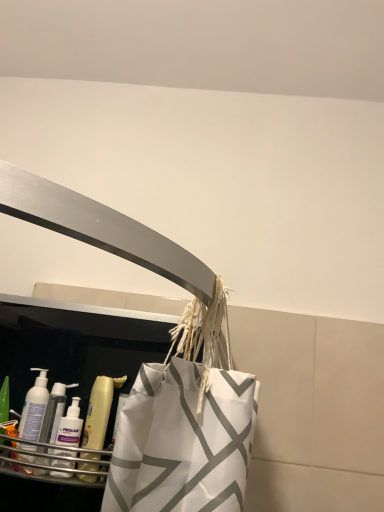
Question: Is translucent plastic bottle at left, marked as the second cleaning product in a left-to-right arrangement, completely or partially inside white plastic bottle at lower left, which is the 1th cleaning product in left-to-right order?

Choices:
 (A) no
 (B) yes

Answer: (A)

Question: Can you confirm if white plastic bottle at lower left, which is the 1th cleaning product in left-to-right order, is smaller than translucent plastic bottle at left, which is counted as the 1th cleaning product, starting from the right?

Choices:
 (A) yes
 (B) no

Answer: (B)

Question: Is white plastic bottle at lower left, which is the 1th cleaning product in left-to-right order, to the left of translucent plastic bottle at left, marked as the second cleaning product in a left-to-right arrangement, from the viewer's perspective?

Choices:
 (A) yes
 (B) no

Answer: (A)

Question: Is the depth of white plastic bottle at lower left, which is the second cleaning product from right to left, greater than that of translucent plastic bottle at left, marked as the second cleaning product in a left-to-right arrangement?

Choices:
 (A) no
 (B) yes

Answer: (B)

Question: From the image's perspective, does white plastic bottle at lower left, which is the 1th cleaning product in left-to-right order, appear lower than translucent plastic bottle at left, marked as the second cleaning product in a left-to-right arrangement?

Choices:
 (A) yes
 (B) no

Answer: (B)

Question: From a real-world perspective, is translucent plastic mouthwash at lower left above or below translucent plastic bottle at left, which is counted as the 1th cleaning product, starting from the right?

Choices:
 (A) below
 (B) above

Answer: (B)

Question: Considering the relative positions of translucent plastic mouthwash at lower left and translucent plastic bottle at left, marked as the second cleaning product in a left-to-right arrangement, in the image provided, is translucent plastic mouthwash at lower left to the left or to the right of translucent plastic bottle at left, marked as the second cleaning product in a left-to-right arrangement,?

Choices:
 (A) left
 (B) right

Answer: (B)

Question: Considering the positions of translucent plastic mouthwash at lower left and translucent plastic bottle at left, marked as the second cleaning product in a left-to-right arrangement, in the image, is translucent plastic mouthwash at lower left bigger or smaller than translucent plastic bottle at left, marked as the second cleaning product in a left-to-right arrangement,?

Choices:
 (A) small
 (B) big

Answer: (B)

Question: Is translucent plastic mouthwash at lower left taller or shorter than translucent plastic bottle at left, which is counted as the 1th cleaning product, starting from the right?

Choices:
 (A) short
 (B) tall

Answer: (B)

Question: Is point (43, 371) closer or farther from the camera than point (56, 381)?

Choices:
 (A) closer
 (B) farther

Answer: (B)

Question: Do you think white plastic bottle at lower left, which is the 1th cleaning product in left-to-right order, is within translucent plastic bottle at left, which is counted as the 1th cleaning product, starting from the right, or outside of it?

Choices:
 (A) inside
 (B) outside

Answer: (B)

Question: Considering the positions of white plastic bottle at lower left, which is the 1th cleaning product in left-to-right order, and translucent plastic bottle at left, which is counted as the 1th cleaning product, starting from the right, in the image, is white plastic bottle at lower left, which is the 1th cleaning product in left-to-right order, taller or shorter than translucent plastic bottle at left, which is counted as the 1th cleaning product, starting from the right,?

Choices:
 (A) short
 (B) tall

Answer: (B)

Question: Looking at their shapes, would you say white plastic bottle at lower left, which is the 1th cleaning product in left-to-right order, is wider or thinner than translucent plastic bottle at left, marked as the second cleaning product in a left-to-right arrangement?

Choices:
 (A) wide
 (B) thin

Answer: (A)

Question: From the image's perspective, is white plastic bottle at lower left, which is the second cleaning product from right to left, located above or below translucent plastic mouthwash at lower left?

Choices:
 (A) below
 (B) above

Answer: (B)

Question: Is white plastic bottle at lower left, which is the second cleaning product from right to left, wider or thinner than translucent plastic mouthwash at lower left?

Choices:
 (A) wide
 (B) thin

Answer: (B)